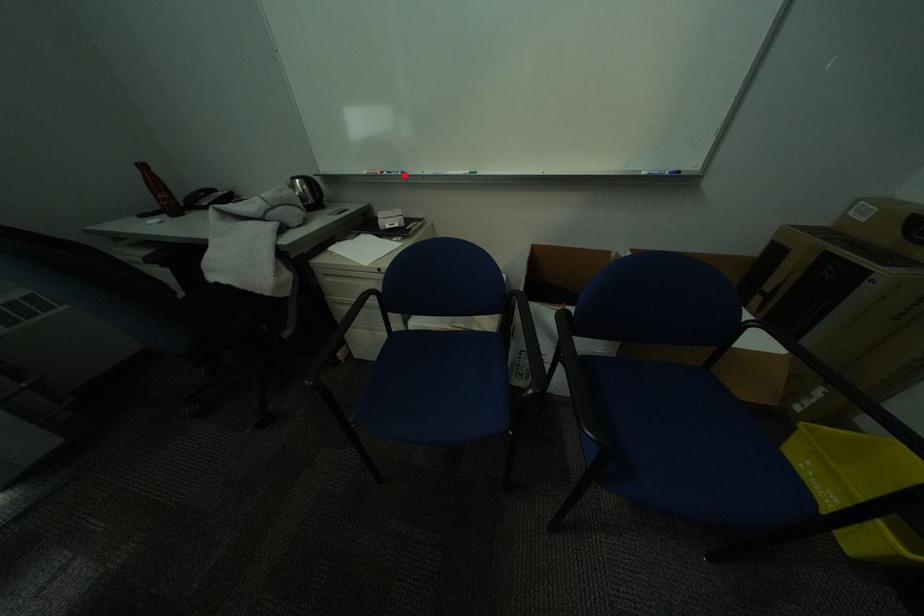
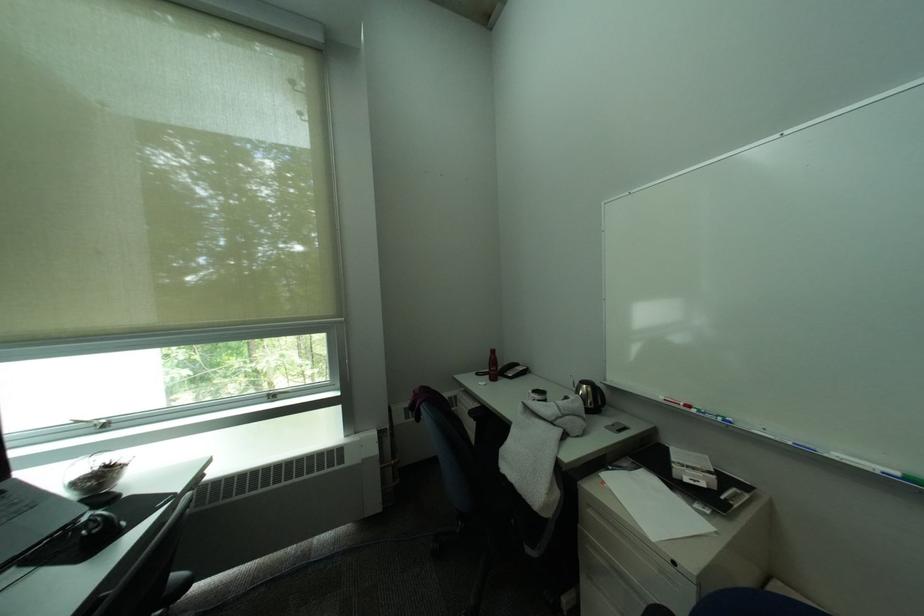
Locate, in the second image, the point that corresponds to the highlighted location in the first image.

(719, 416)